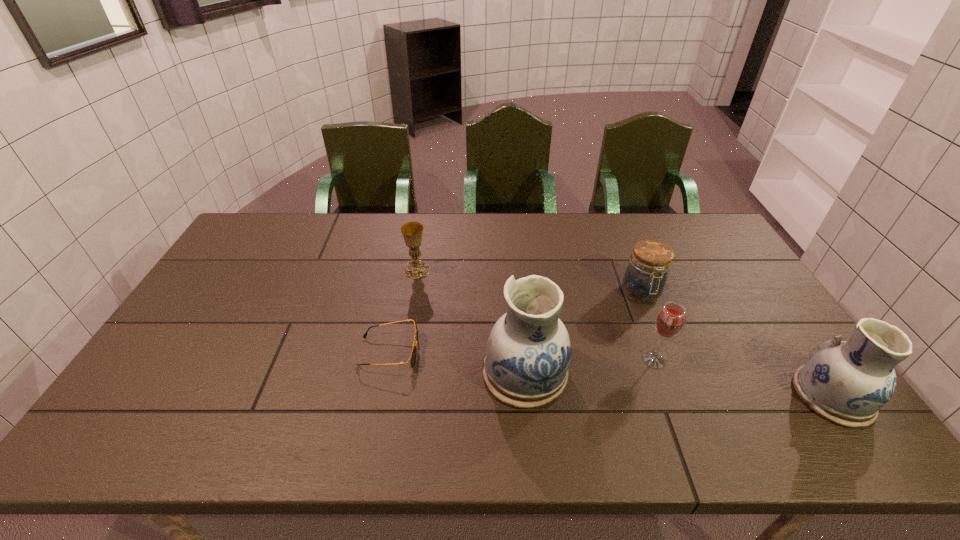
Where is `free space that satisfies the following two spatial constraints: 1. on the front-facing side of the shortest object; 2. on the right side of the taller pottery`? This screenshot has width=960, height=540. free space that satisfies the following two spatial constraints: 1. on the front-facing side of the shortest object; 2. on the right side of the taller pottery is located at coordinates (385, 372).

Where is `vacant region that satisfies the following two spatial constraints: 1. on the back side of the wineglass; 2. on the front-facing side of the sunglasses`? vacant region that satisfies the following two spatial constraints: 1. on the back side of the wineglass; 2. on the front-facing side of the sunglasses is located at coordinates (652, 352).

At what (x,y) coordinates should I click in order to perform the action: click on vacant point that satisfies the following two spatial constraints: 1. on the front-facing side of the shortest object; 2. on the right side of the wineglass. Please return your answer as a coordinate pair (x, y). Looking at the image, I should click on (388, 360).

You are a GUI agent. You are given a task and a screenshot of the screen. Output one action in this format:
    pyautogui.click(x=<x>, y=<y>)
    Task: Click on the free spot that satisfies the following two spatial constraints: 1. on the front side of the shorter pottery; 2. on the left side of the farthest object
    Image resolution: width=960 pixels, height=540 pixels.
    Given the screenshot: What is the action you would take?
    pyautogui.click(x=396, y=396)